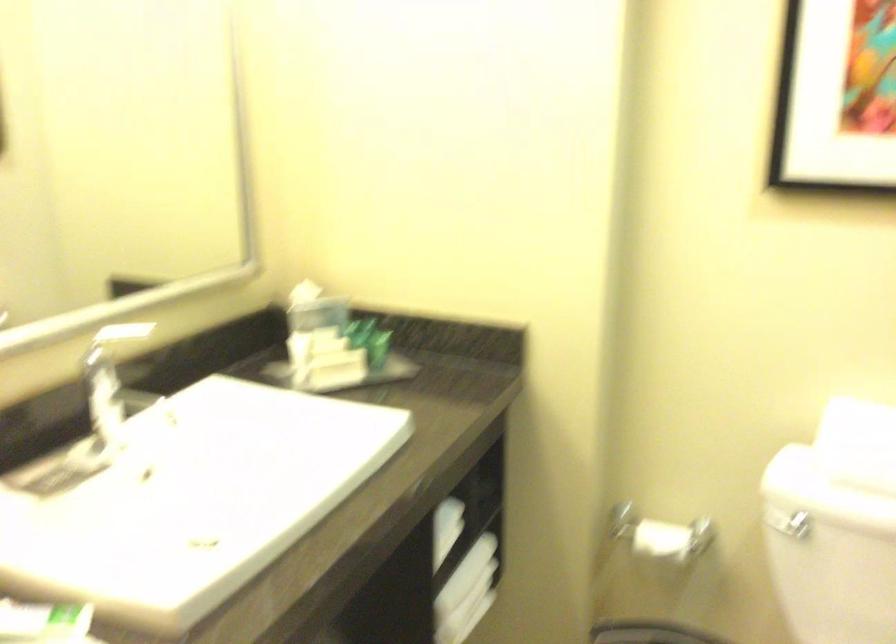
This screenshot has height=644, width=896. What do you see at coordinates (115, 339) in the screenshot?
I see `the silver faucet handle` at bounding box center [115, 339].